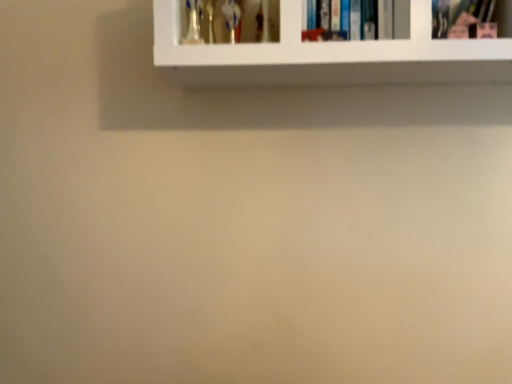
The height and width of the screenshot is (384, 512). I want to click on pink matte book at upper right, placed as the second book when sorted from back to front, so click(x=471, y=19).

Measure the distance between point (282, 11) and camera.

The distance of point (282, 11) from camera is 3.39 feet.

This screenshot has width=512, height=384. I want to click on pink matte book at upper right, the 1th book in the front-to-back sequence, so click(471, 19).

Is point (448, 26) in front of point (393, 13)?

No, (448, 26) is behind (393, 13).

Could you measure the distance between pink matte book at upper right, marked as the 1th book in a right-to-left arrangement, and hardcover book at upper center, arranged as the 2th book when viewed from the front?

The distance of pink matte book at upper right, marked as the 1th book in a right-to-left arrangement, from hardcover book at upper center, arranged as the 2th book when viewed from the front, is 7.70 inches.

Is pink matte book at upper right, placed as the second book when sorted from back to front, facing towards hardcover book at upper center, the first book in the back-to-front sequence?

No, pink matte book at upper right, placed as the second book when sorted from back to front, is not aimed at hardcover book at upper center, the first book in the back-to-front sequence.

In the image, is pink matte book at upper right, marked as the 1th book in a right-to-left arrangement, positioned in front of or behind hardcover book at upper center, the first book in the back-to-front sequence?

pink matte book at upper right, marked as the 1th book in a right-to-left arrangement, is in front of hardcover book at upper center, the first book in the back-to-front sequence.

Where is `book that appears above the pink matte book at upper right, marked as the 1th book in a right-to-left arrangement (from a real-world perspective)`? The width and height of the screenshot is (512, 384). book that appears above the pink matte book at upper right, marked as the 1th book in a right-to-left arrangement (from a real-world perspective) is located at coordinates (356, 20).

Is pink matte book at upper right, the second book from the left, at the back of hardcover book at upper center, placed as the 2th book when sorted from right to left?

No, hardcover book at upper center, placed as the 2th book when sorted from right to left, is not facing the opposite direction of pink matte book at upper right, the second book from the left.

Considering their positions, is hardcover book at upper center, placed as the 2th book when sorted from right to left, located in front of or behind pink matte book at upper right, placed as the second book when sorted from back to front?

hardcover book at upper center, placed as the 2th book when sorted from right to left, is behind pink matte book at upper right, placed as the second book when sorted from back to front.

From the image's perspective, which one is positioned lower, hardcover book at upper center, placed as the 2th book when sorted from right to left, or pink matte book at upper right, placed as the second book when sorted from back to front?

pink matte book at upper right, placed as the second book when sorted from back to front, appears lower in the image.

Is pink matte book at upper right, marked as the 1th book in a right-to-left arrangement, taller or shorter than white glossy shelf at upper center?

Considering their sizes, pink matte book at upper right, marked as the 1th book in a right-to-left arrangement, has less height than white glossy shelf at upper center.

From the image's perspective, is pink matte book at upper right, placed as the second book when sorted from back to front, positioned above or below white glossy shelf at upper center?

pink matte book at upper right, placed as the second book when sorted from back to front, is below white glossy shelf at upper center.

At what (x,y) coordinates should I click in order to perform the action: click on shelf in front of the pink matte book at upper right, the 1th book in the front-to-back sequence. Please return your answer as a coordinate pair (x, y). The width and height of the screenshot is (512, 384). Looking at the image, I should click on (327, 56).

In the image, is pink matte book at upper right, placed as the second book when sorted from back to front, positioned in front of or behind white glossy shelf at upper center?

Visually, pink matte book at upper right, placed as the second book when sorted from back to front, is located behind white glossy shelf at upper center.

This screenshot has height=384, width=512. Find the location of `book above the white glossy shelf at upper center (from a real-world perspective)`. book above the white glossy shelf at upper center (from a real-world perspective) is located at coordinates (356, 20).

Between white glossy shelf at upper center and hardcover book at upper center, acting as the first book starting from the left, which one is positioned in front?

white glossy shelf at upper center.

Who is shorter, white glossy shelf at upper center or hardcover book at upper center, arranged as the 2th book when viewed from the front?

hardcover book at upper center, arranged as the 2th book when viewed from the front.

Do you think white glossy shelf at upper center is within pink matte book at upper right, marked as the 1th book in a right-to-left arrangement, or outside of it?

white glossy shelf at upper center is not enclosed by pink matte book at upper right, marked as the 1th book in a right-to-left arrangement.

Between point (281, 0) and point (449, 37), which one is positioned behind?

The point (449, 37) is more distant.

Can you tell me how much white glossy shelf at upper center and pink matte book at upper right, marked as the 1th book in a right-to-left arrangement, differ in facing direction?

The angle between the facing direction of white glossy shelf at upper center and the facing direction of pink matte book at upper right, marked as the 1th book in a right-to-left arrangement, is 0.0723 degrees.

Is white glossy shelf at upper center positioned with its back to pink matte book at upper right, the 1th book in the front-to-back sequence?

Yes, white glossy shelf at upper center is positioned with its back facing pink matte book at upper right, the 1th book in the front-to-back sequence.

Considering the sizes of hardcover book at upper center, the first book in the back-to-front sequence, and white glossy shelf at upper center in the image, is hardcover book at upper center, the first book in the back-to-front sequence, bigger or smaller than white glossy shelf at upper center?

In the image, hardcover book at upper center, the first book in the back-to-front sequence, appears to be smaller than white glossy shelf at upper center.

From the image's perspective, is hardcover book at upper center, arranged as the 2th book when viewed from the front, under white glossy shelf at upper center?

Incorrect, from the image's perspective, hardcover book at upper center, arranged as the 2th book when viewed from the front, is higher than white glossy shelf at upper center.

Where is `book on the left of white glossy shelf at upper center`? book on the left of white glossy shelf at upper center is located at coordinates (356, 20).

Between hardcover book at upper center, arranged as the 2th book when viewed from the front, and white glossy shelf at upper center, which one has more height?

With more height is white glossy shelf at upper center.

Find the location of `book directly beneath the hardcover book at upper center, arranged as the 2th book when viewed from the front (from a real-world perspective)`. book directly beneath the hardcover book at upper center, arranged as the 2th book when viewed from the front (from a real-world perspective) is located at coordinates (471, 19).

Where is `book above the pink matte book at upper right, placed as the second book when sorted from back to front (from the image's perspective)`? book above the pink matte book at upper right, placed as the second book when sorted from back to front (from the image's perspective) is located at coordinates (356, 20).

In the scene shown: Which object lies further to the anchor point pink matte book at upper right, marked as the 1th book in a right-to-left arrangement, white glossy shelf at upper center or hardcover book at upper center, placed as the 2th book when sorted from right to left?

white glossy shelf at upper center lies further to pink matte book at upper right, marked as the 1th book in a right-to-left arrangement, than the other object.

Estimate the real-world distances between objects in this image. Which object is closer to hardcover book at upper center, acting as the first book starting from the left, white glossy shelf at upper center or pink matte book at upper right, placed as the second book when sorted from back to front?

Among the two, white glossy shelf at upper center is located nearer to hardcover book at upper center, acting as the first book starting from the left.

Considering their positions, is pink matte book at upper right, the second book from the left, positioned closer to hardcover book at upper center, the first book in the back-to-front sequence, than white glossy shelf at upper center?

The object closer to hardcover book at upper center, the first book in the back-to-front sequence, is white glossy shelf at upper center.

From the image, which object appears to be farther from white glossy shelf at upper center, hardcover book at upper center, acting as the first book starting from the left, or pink matte book at upper right, the second book from the left?

Based on the image, pink matte book at upper right, the second book from the left, appears to be further to white glossy shelf at upper center.

Considering their positions, is pink matte book at upper right, the 1th book in the front-to-back sequence, positioned closer to white glossy shelf at upper center than hardcover book at upper center, the first book in the back-to-front sequence?

hardcover book at upper center, the first book in the back-to-front sequence, is closer to white glossy shelf at upper center.

Considering their positions, is hardcover book at upper center, placed as the 2th book when sorted from right to left, positioned further to pink matte book at upper right, marked as the 1th book in a right-to-left arrangement, than white glossy shelf at upper center?

Based on the image, white glossy shelf at upper center appears to be further to pink matte book at upper right, marked as the 1th book in a right-to-left arrangement.

This screenshot has width=512, height=384. In order to click on shelf between hardcover book at upper center, arranged as the 2th book when viewed from the front, and pink matte book at upper right, the second book from the left, from left to right in this screenshot , I will do `click(327, 56)`.